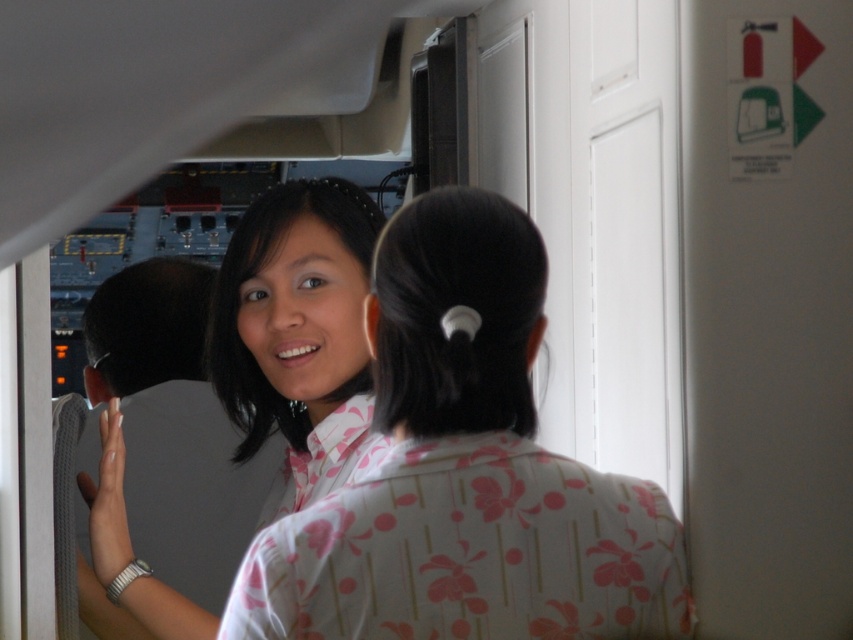
Who is taller, pink floral shirt at center or matte white shirt at center?

matte white shirt at center

At what (x,y) coordinates should I click in order to perform the action: click on pink floral shirt at center. Please return your answer as a coordinate pair (x, y). The height and width of the screenshot is (640, 853). Looking at the image, I should click on (456, 476).

Who is more distant from viewer, (413, 243) or (134, 422)?

The point (134, 422) is behind.

You are a GUI agent. You are given a task and a screenshot of the screen. Output one action in this format:
    pyautogui.click(x=<x>, y=<y>)
    Task: Click on the pink floral shirt at center
    
    Given the screenshot: What is the action you would take?
    pyautogui.click(x=456, y=476)